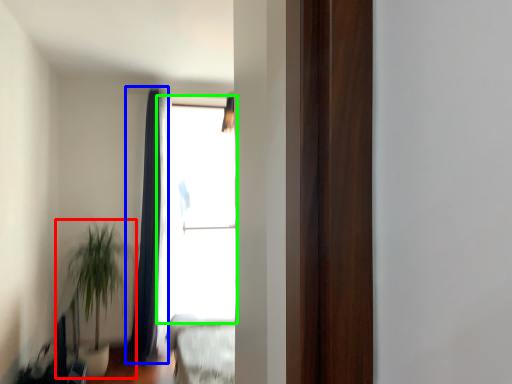
Question: Which object is positioned closest to houseplant (highlighted by a red box)? Select from curtain (highlighted by a blue box) and window (highlighted by a green box).

Choices:
 (A) curtain
 (B) window

Answer: (A)